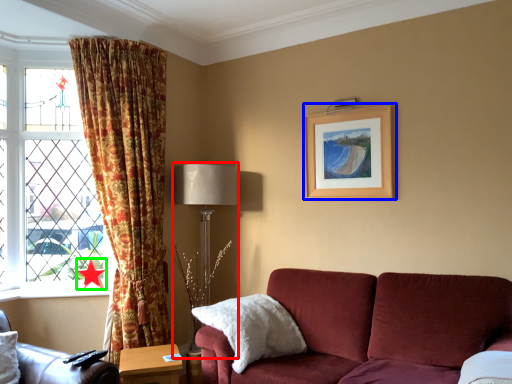
Question: Which object is positioned closest to table lamp (highlighted by a red box)? Select from picture frame (highlighted by a blue box) and star (highlighted by a green box).

Choices:
 (A) picture frame
 (B) star

Answer: (A)